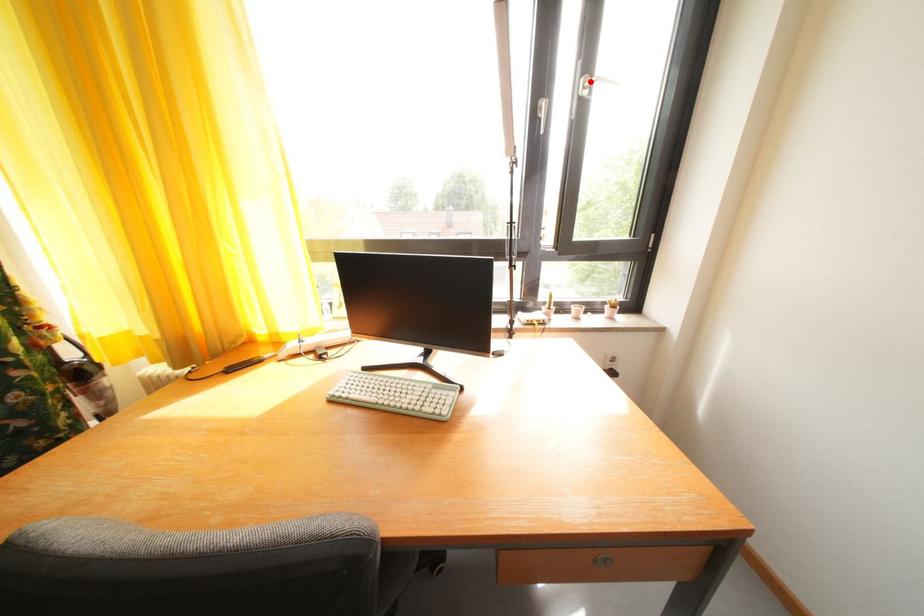
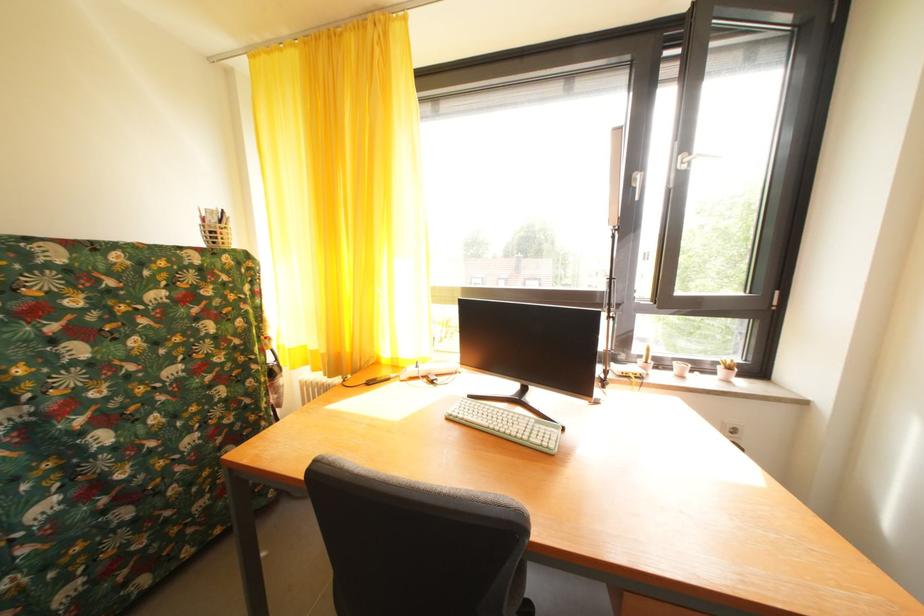
Find the pixel in the second image that matches the highlighted location in the first image.

(689, 159)